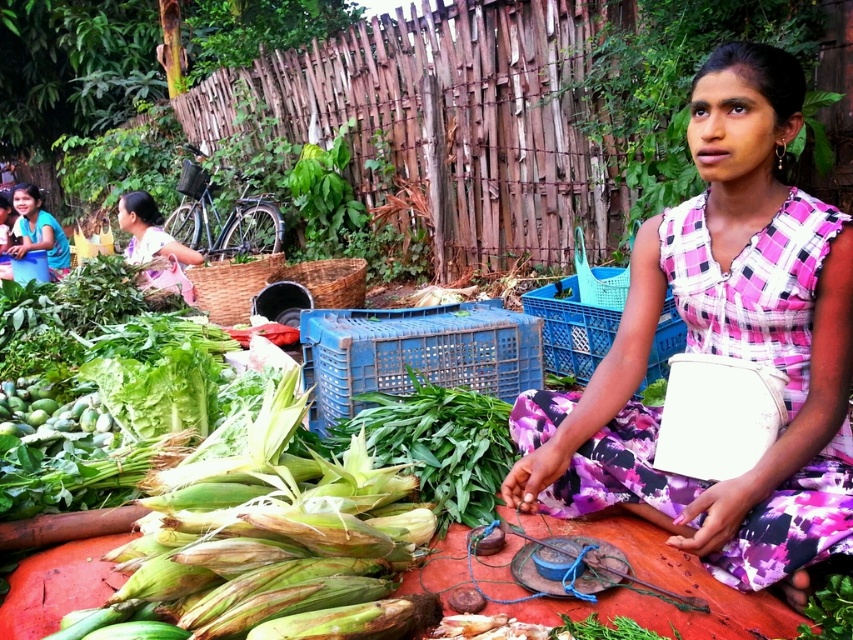
Question: Is green rough corn at lower left bigger than matte blue bucket at upper left?

Choices:
 (A) yes
 (B) no

Answer: (B)

Question: Is green rough corn at lower left behind matte blue bucket at upper left?

Choices:
 (A) no
 (B) yes

Answer: (A)

Question: Which point is closer to the camera?

Choices:
 (A) matte blue bucket at upper left
 (B) green leafy vegetable at center
 (C) pink fabric skirt at upper left

Answer: (B)

Question: Does pink fabric skirt at upper left appear over matte blue bucket at upper left?

Choices:
 (A) yes
 (B) no

Answer: (B)

Question: Which object is closer to the camera taking this photo?

Choices:
 (A) pink plaid dress at center
 (B) pink fabric skirt at upper left
 (C) green rough corn at lower left
 (D) green leafy vegetable at center

Answer: (C)

Question: Which object is the farthest from the green rough corn at lower left?

Choices:
 (A) pink plaid dress at center
 (B) green leafy vegetable at center
 (C) matte blue bucket at upper left
 (D) pink fabric skirt at upper left

Answer: (C)